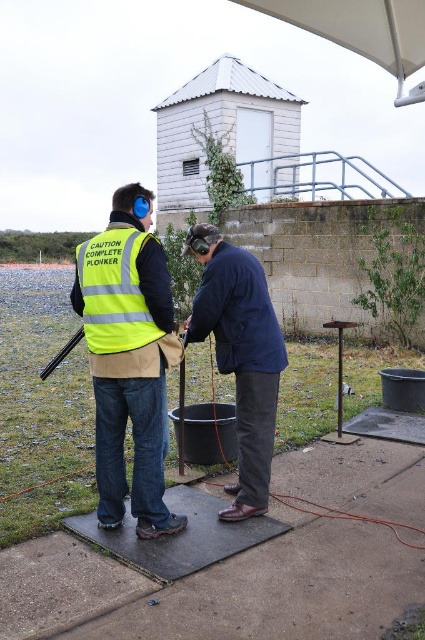
You are a safety inspector at the shooting range. You need to ensure that all equipment is properly spaced for safety. The minimum required distance between the concrete slab at center and the yellow reflective safety vest at left is 1.6 meters. Is the current distance compliant with safety regulations?

The concrete slab at center and the yellow reflective safety vest at left are 1.58 meters apart from each other. Since the required minimum distance is 1.6 meters, the current spacing is 0.02 meters too short and does not comply with safety regulations.

You are a safety officer at the shooting range. You need to ensure that the concrete slab at center and the dark blue fabric at center are arranged correctly according to the layout. Which object should be placed to the left of the other?

The dark blue fabric at center should be placed to the left of the concrete slab at center because the concrete slab at center is positioned on the right side of dark blue fabric at center.